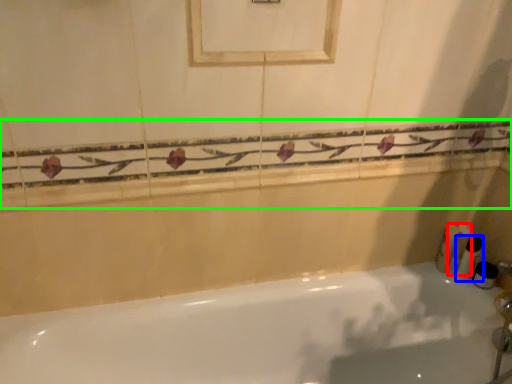
Question: Which object is positioned farthest from toiletry (highlighted by a red box)? Select from toiletry (highlighted by a blue box) and balustrade (highlighted by a green box).

Choices:
 (A) toiletry
 (B) balustrade

Answer: (B)